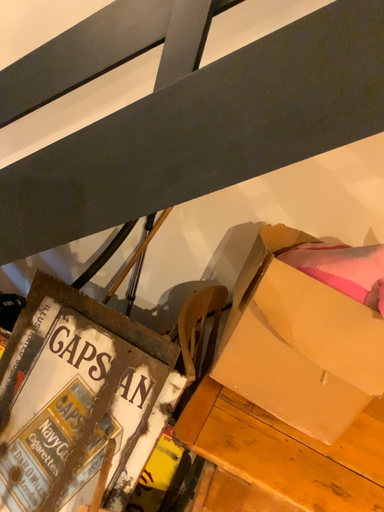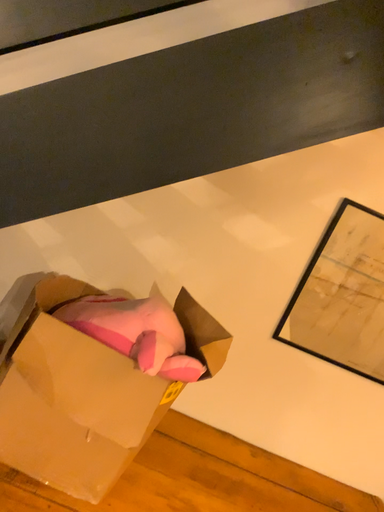
Question: Which way did the camera rotate in the video?

Choices:
 (A) rotated downward
 (B) rotated upward

Answer: (B)